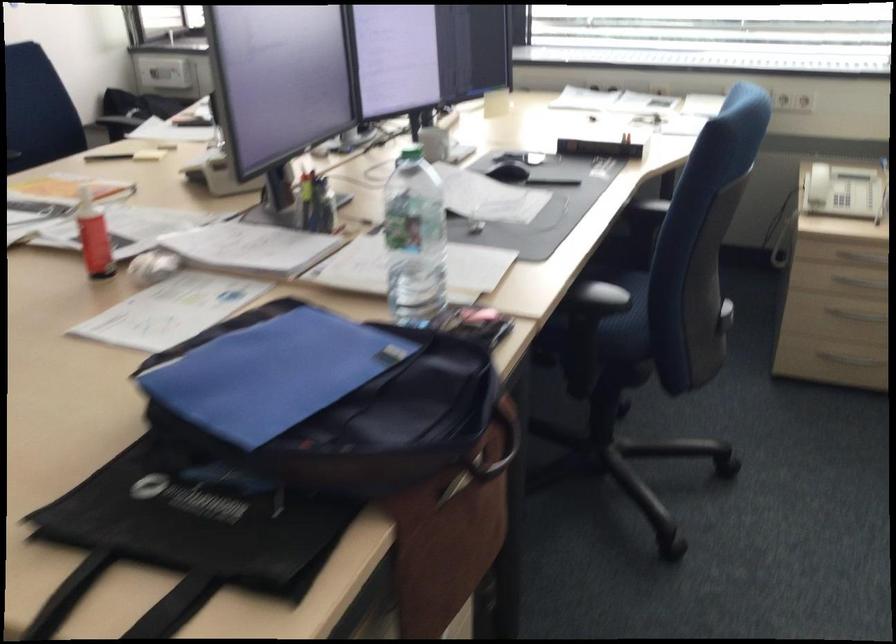
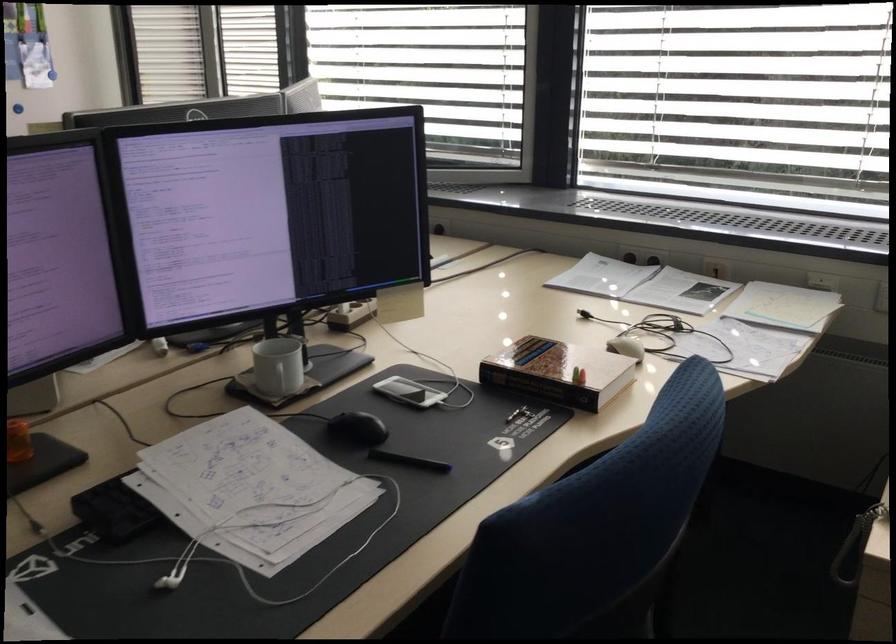
The images are taken continuously from a first-person perspective. In which direction are you moving?

The cameraman moved toward right, forward.